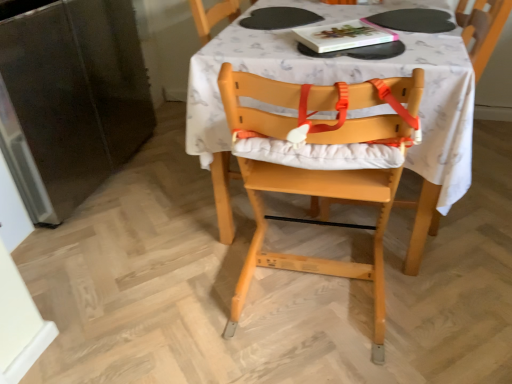
The height and width of the screenshot is (384, 512). In order to click on vacant space to the left of natural wood highchair at center in this screenshot , I will do `click(187, 284)`.